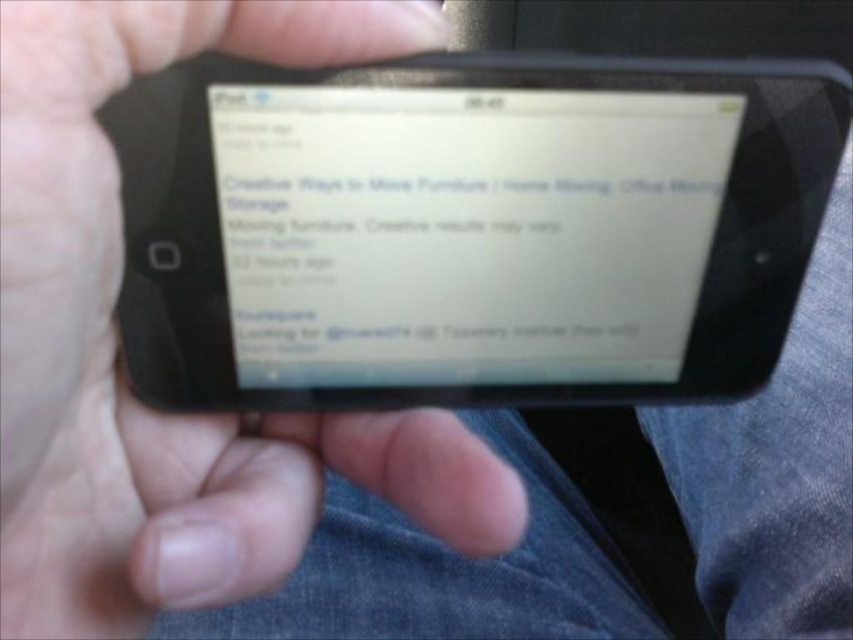
Does black matte phone at center have a greater width compared to white matte screen at center?

No, black matte phone at center is not wider than white matte screen at center.

Does black matte phone at center appear under white matte screen at center?

Yes, black matte phone at center is below white matte screen at center.

What do you see at coordinates (113, 349) in the screenshot? Image resolution: width=853 pixels, height=640 pixels. I see `black matte phone at center` at bounding box center [113, 349].

The height and width of the screenshot is (640, 853). What are the coordinates of `black matte phone at center` in the screenshot? It's located at [113, 349].